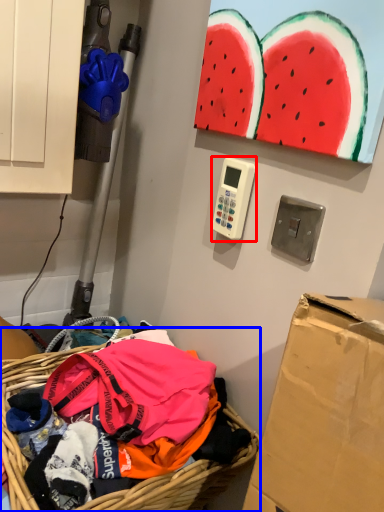
Question: Which object appears farthest to the camera in this image, scale (highlighted by a red box) or basket (highlighted by a blue box)?

Choices:
 (A) scale
 (B) basket

Answer: (A)